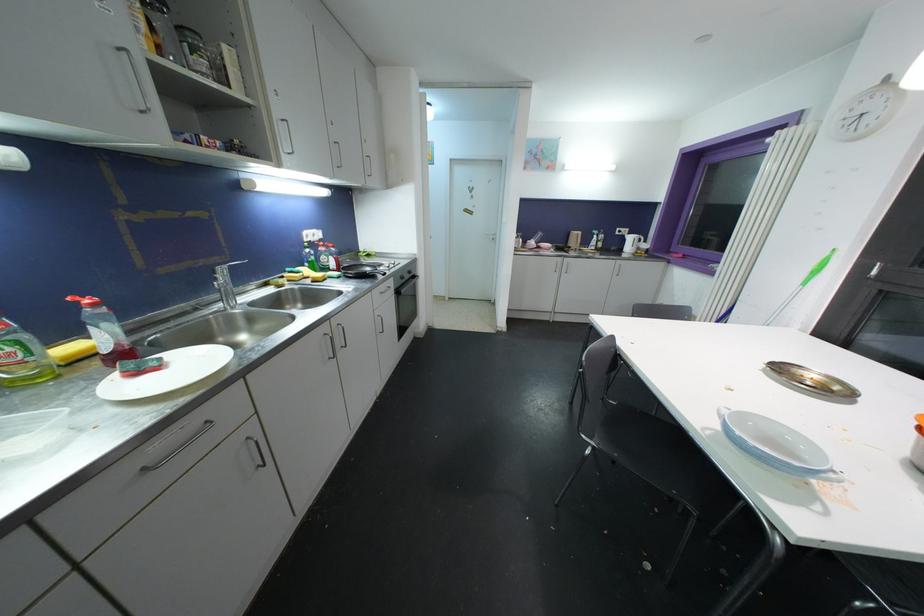
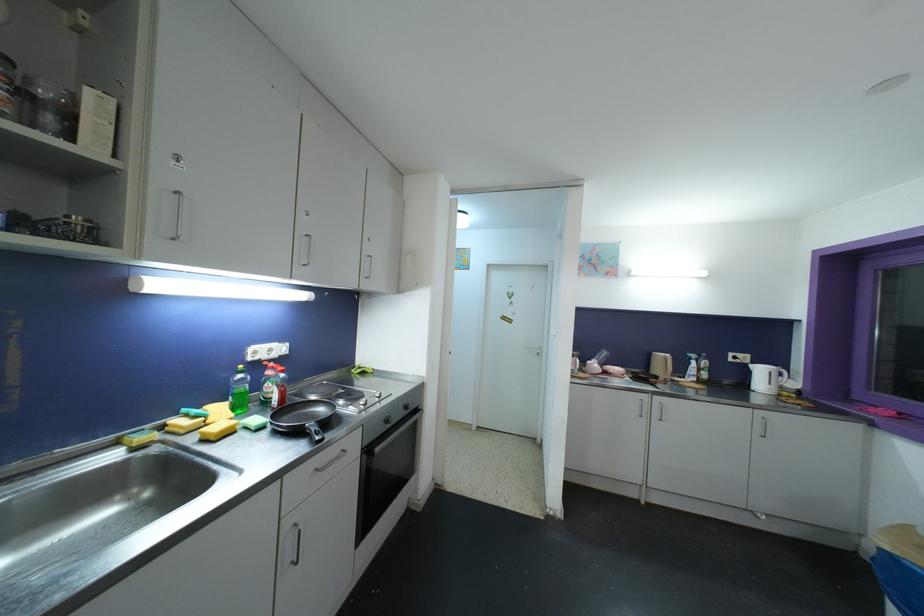
Locate, in the second image, the point that corresponds to point 621,232 in the first image.

(734, 357)